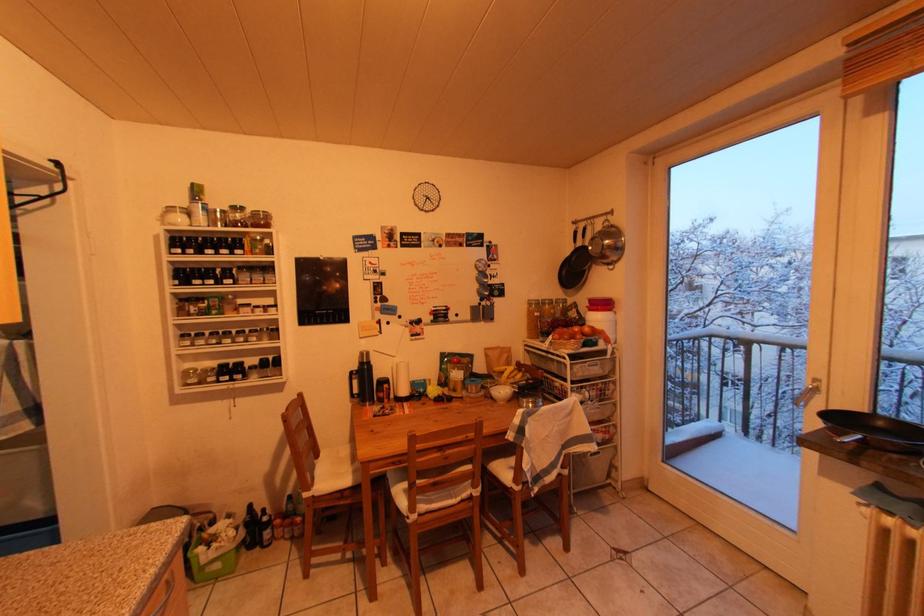
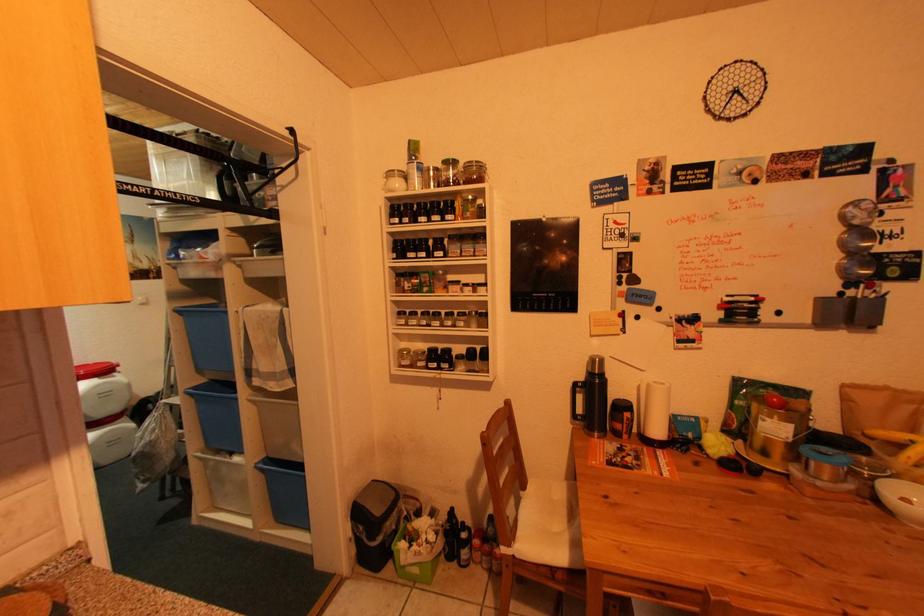
Question: Based on the continuous images, in which direction is the camera rotating? Reply with the corresponding letter.

Choices:
 (A) Left
 (B) Right
 (C) Up
 (D) Down

Answer: (A)